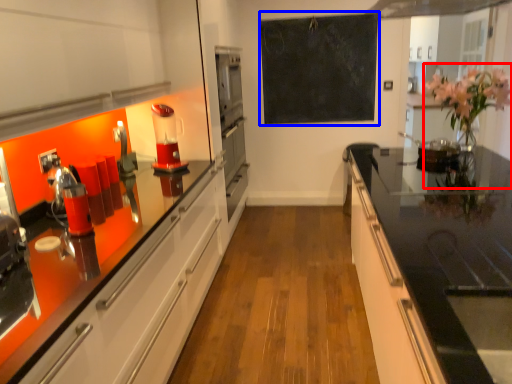
Question: Which object is further to the camera taking this photo, floral arrangement (highlighted by a red box) or bulletin board (highlighted by a blue box)?

Choices:
 (A) floral arrangement
 (B) bulletin board

Answer: (B)